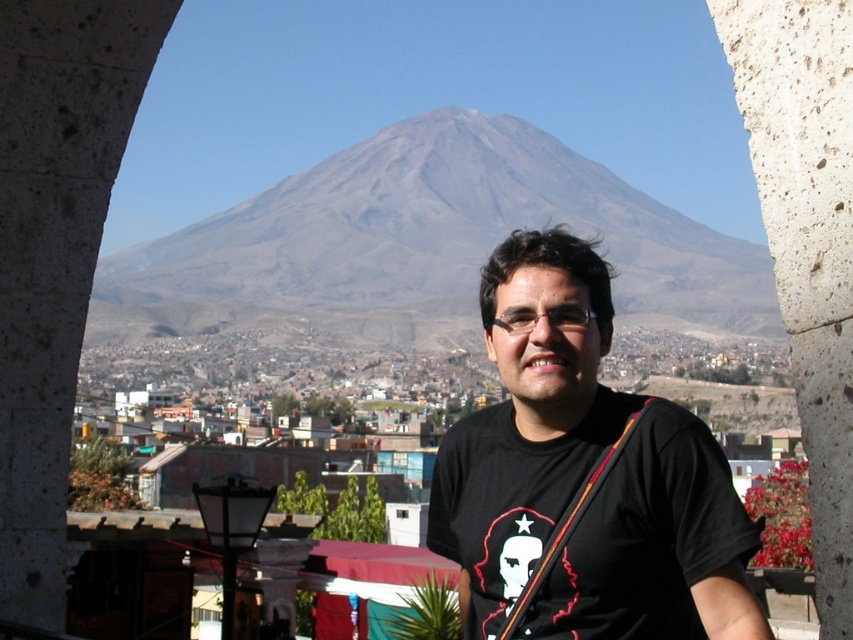
Can you confirm if gray/desert-textured mountain at center is positioned to the left of gray stone pillar at right?

Indeed, gray/desert-textured mountain at center is positioned on the left side of gray stone pillar at right.

Is gray/desert-textured mountain at center below gray stone pillar at right?

No, gray/desert-textured mountain at center is not below gray stone pillar at right.

Is point (233, 323) farther from viewer compared to point (740, 49)?

Yes, point (233, 323) is behind point (740, 49).

Identify the location of gray/desert-textured mountain at center. [425, 243].

Which is below, gray stone pillar at right or orange fabric strap at center?

Result: orange fabric strap at center

Which is more to the left, gray stone pillar at right or orange fabric strap at center?

Positioned to the left is orange fabric strap at center.

Does point (752, 97) come in front of point (550, 548)?

That is True.

Locate an element on the screen. Image resolution: width=853 pixels, height=640 pixels. gray stone pillar at right is located at coordinates (805, 237).

Is point (430, 177) positioned behind point (750, 592)?

That is True.

Find the location of a particular element. This screenshot has width=853, height=640. gray/desert-textured mountain at center is located at coordinates (425, 243).